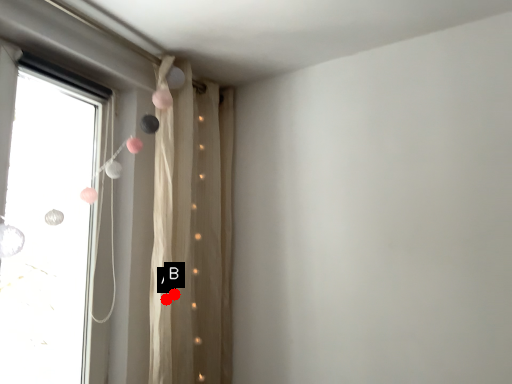
Question: Two points are circled on the image, labeled by A and B beside each circle. Which point appears closest to the camera in this image?

Choices:
 (A) A is closer
 (B) B is closer

Answer: (A)